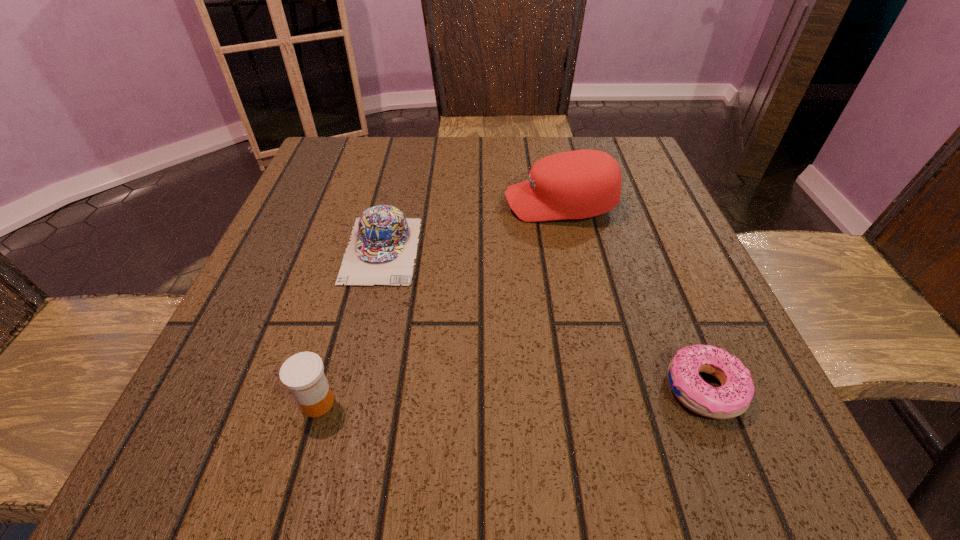
Locate which object ranks in proximity to the medicine. Please provide its 2D coordinates. Your answer should be formatted as a tuple, i.e. [(x, y)], where the tuple contains the x and y coordinates of a point satisfying the conditions above.

[(382, 249)]

Identify the location of blank space that satisfies the following two spatial constraints: 1. on the front-facing side of the tallest object; 2. on the back side of the doughnut. The width and height of the screenshot is (960, 540). (601, 388).

Find the location of `blank space that satisfies the following two spatial constraints: 1. on the front, side, and top of the shorter cap; 2. on the label of the medicine`. blank space that satisfies the following two spatial constraints: 1. on the front, side, and top of the shorter cap; 2. on the label of the medicine is located at coordinates (346, 403).

Locate an element on the screen. free point that satisfies the following two spatial constraints: 1. on the front, side, and top of the shortest object; 2. on the right side of the second shortest object is located at coordinates (349, 388).

At what (x,y) coordinates should I click in order to perform the action: click on free spot that satisfies the following two spatial constraints: 1. on the front side of the shortest object; 2. on the label of the medicine. Please return your answer as a coordinate pair (x, y). The width and height of the screenshot is (960, 540). Looking at the image, I should click on (709, 403).

Locate an element on the screen. vacant space that satisfies the following two spatial constraints: 1. on the front, side, and top of the shorter cap; 2. on the label of the third shortest object is located at coordinates (346, 403).